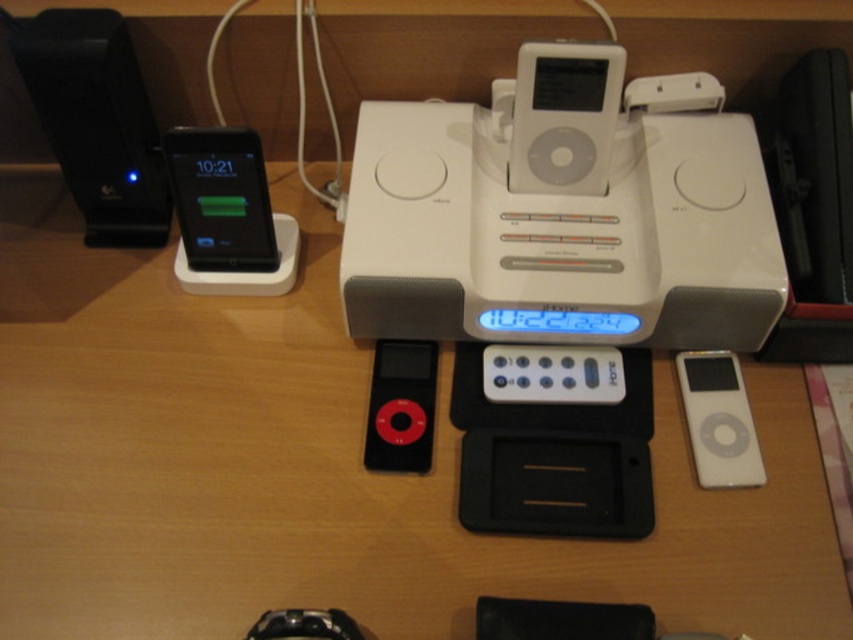
Can you confirm if white plastic ipod at right is positioned below white plastic remote at center?

Correct, white plastic ipod at right is located below white plastic remote at center.

You are a GUI agent. You are given a task and a screenshot of the screen. Output one action in this format:
    pyautogui.click(x=<x>, y=<y>)
    Task: Click on the white plastic ipod at right
    The width and height of the screenshot is (853, 640).
    Given the screenshot: What is the action you would take?
    pyautogui.click(x=718, y=420)

Is white plastic stereo at center positioned before black glossy ipod at left?

That is True.

Is point (602, 204) less distant than point (173, 148)?

No.

Is point (558, 292) positioned after point (178, 136)?

No, (558, 292) is closer to viewer.

Where is `white plastic stereo at center`? white plastic stereo at center is located at coordinates (560, 236).

Is point (695, 195) farther from viewer compared to point (78, 134)?

No, (695, 195) is in front of (78, 134).

Which is more to the left, white plastic stereo at center or black plastic speaker at left?

black plastic speaker at left is more to the left.

This screenshot has height=640, width=853. I want to click on white plastic stereo at center, so click(x=560, y=236).

This screenshot has width=853, height=640. Find the location of `white plastic stereo at center`. white plastic stereo at center is located at coordinates (560, 236).